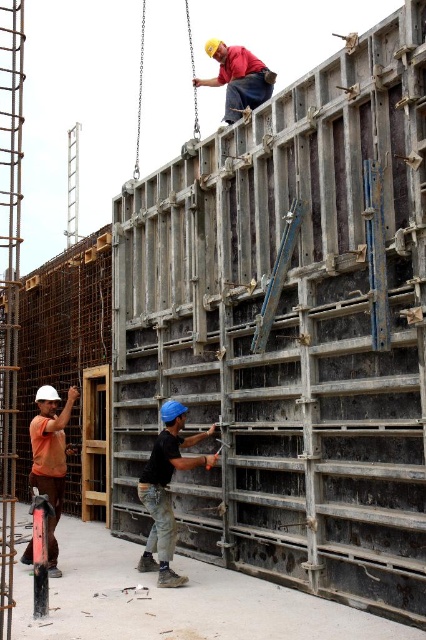
You are a safety inspector observing the construction site. You notice two objects labeled as the black matte construction worker at center and the matte black shirt at upper center. Based on their positions, which one appears closer to the ground?

The black matte construction worker at center is shorter than the matte black shirt at upper center, so the construction worker is closer to the ground than the shirt.